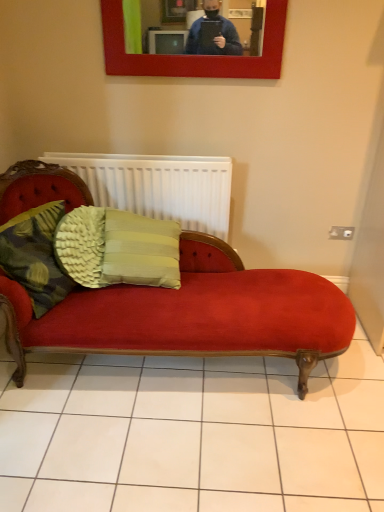
Question: Considering the relative positions of woven fabric cushion at left, placed as the first pillow when sorted from left to right, and white matte radiator at center in the image provided, is woven fabric cushion at left, placed as the first pillow when sorted from left to right, to the right of white matte radiator at center from the viewer's perspective?

Choices:
 (A) yes
 (B) no

Answer: (B)

Question: Is woven fabric cushion at left, positioned as the second pillow in right-to-left order, taller than white matte radiator at center?

Choices:
 (A) yes
 (B) no

Answer: (B)

Question: Is woven fabric cushion at left, placed as the first pillow when sorted from left to right, further to the viewer compared to white matte radiator at center?

Choices:
 (A) no
 (B) yes

Answer: (A)

Question: From the image's perspective, is woven fabric cushion at left, positioned as the second pillow in right-to-left order, above white matte radiator at center?

Choices:
 (A) yes
 (B) no

Answer: (B)

Question: Does woven fabric cushion at left, positioned as the second pillow in right-to-left order, appear on the left side of white matte radiator at center?

Choices:
 (A) yes
 (B) no

Answer: (A)

Question: Is woven fabric cushion at left, placed as the first pillow when sorted from left to right, smaller than white matte radiator at center?

Choices:
 (A) yes
 (B) no

Answer: (A)

Question: Is white matte radiator at center facing towards woven fabric cushion at left, positioned as the second pillow in right-to-left order?

Choices:
 (A) yes
 (B) no

Answer: (A)

Question: Is white matte radiator at center further to camera compared to woven fabric cushion at left, positioned as the second pillow in right-to-left order?

Choices:
 (A) yes
 (B) no

Answer: (A)

Question: Considering the relative sizes of white matte radiator at center and woven fabric cushion at left, positioned as the second pillow in right-to-left order, in the image provided, is white matte radiator at center bigger than woven fabric cushion at left, positioned as the second pillow in right-to-left order,?

Choices:
 (A) yes
 (B) no

Answer: (A)

Question: Is white matte radiator at center in contact with woven fabric cushion at left, positioned as the second pillow in right-to-left order?

Choices:
 (A) yes
 (B) no

Answer: (B)

Question: Is white matte radiator at center outside of woven fabric cushion at left, placed as the first pillow when sorted from left to right?

Choices:
 (A) no
 (B) yes

Answer: (B)

Question: Is white matte radiator at center wider than woven fabric cushion at left, positioned as the second pillow in right-to-left order?

Choices:
 (A) yes
 (B) no

Answer: (B)

Question: Is green textured cushion at center, positioned as the 1th pillow in right-to-left order, surrounding white matte radiator at center?

Choices:
 (A) no
 (B) yes

Answer: (A)